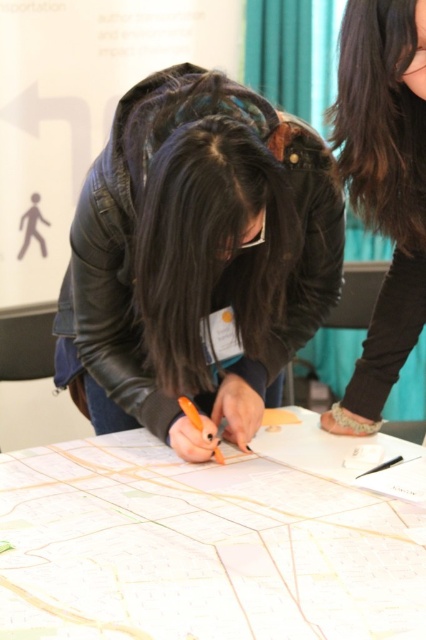
Which is above, white paper map at center or black leather jacket at upper right?

black leather jacket at upper right

Is point (104, 468) farther from camera compared to point (377, 116)?

Yes, point (104, 468) is farther from viewer.

Which is behind, point (54, 525) or point (345, 70)?

The point (345, 70) is behind.

You are a GUI agent. You are given a task and a screenshot of the screen. Output one action in this format:
    pyautogui.click(x=<x>, y=<y>)
    Task: Click on the white paper map at center
    The height and width of the screenshot is (640, 426).
    Given the screenshot: What is the action you would take?
    pyautogui.click(x=207, y=541)

Between leather jacket at center and black leather jacket at upper right, which one is positioned lower?

leather jacket at center

Who is shorter, leather jacket at center or black leather jacket at upper right?

A: With less height is leather jacket at center.

Locate an element on the screen. leather jacket at center is located at coordinates (196, 259).

Who is lower down, leather jacket at center or white paper map at center?

white paper map at center is lower down.

Which of these two, leather jacket at center or white paper map at center, stands shorter?

white paper map at center

Is point (97, 216) positioned after point (304, 440)?

No, (97, 216) is closer to viewer.

Where is `leather jacket at center`? Image resolution: width=426 pixels, height=640 pixels. leather jacket at center is located at coordinates (x=196, y=259).